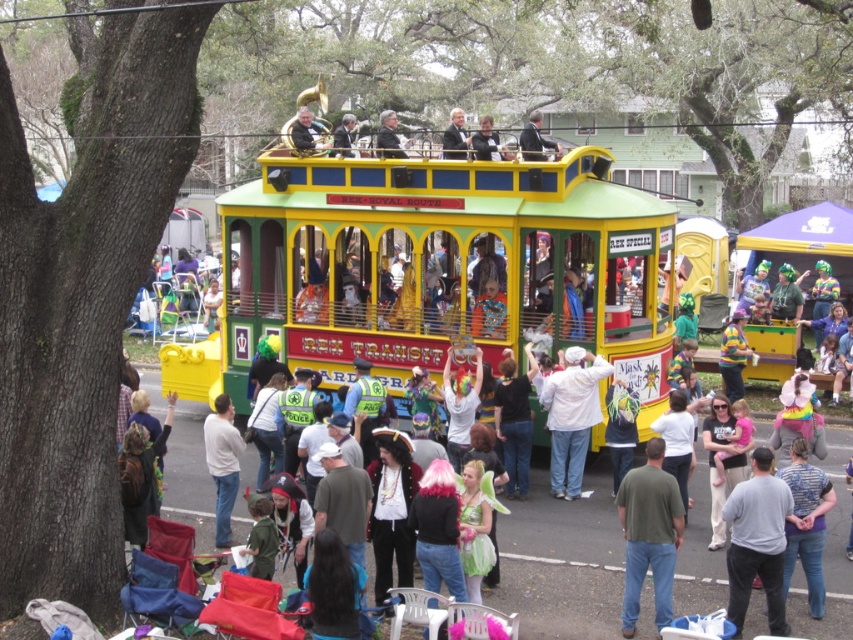
Does blue striped shirt at center appear over matte black jacket at upper center?

Actually, blue striped shirt at center is below matte black jacket at upper center.

Who is taller, blue striped shirt at center or matte black jacket at upper center?

Standing taller between the two is matte black jacket at upper center.

You are a GUI agent. You are given a task and a screenshot of the screen. Output one action in this format:
    pyautogui.click(x=<x>, y=<y>)
    Task: Click on the blue striped shirt at center
    
    Given the screenshot: What is the action you would take?
    pyautogui.click(x=805, y=524)

This screenshot has width=853, height=640. Identify the location of blue striped shirt at center. (x=805, y=524).

Which is behind, point (462, 157) or point (383, 141)?

The point (383, 141) is behind.

Does formal black suit at upper center come behind smooth gray suit at upper center?

No, formal black suit at upper center is closer to the viewer.

You are a GUI agent. You are given a task and a screenshot of the screen. Output one action in this format:
    pyautogui.click(x=<x>, y=<y>)
    Task: Click on the formal black suit at upper center
    The width and height of the screenshot is (853, 640).
    Given the screenshot: What is the action you would take?
    pyautogui.click(x=456, y=136)

Where is `formal black suit at upper center`? formal black suit at upper center is located at coordinates (456, 136).

Is green matte shirt at center bigger than white matte shirt at lower left?

Incorrect, green matte shirt at center is not larger than white matte shirt at lower left.

This screenshot has width=853, height=640. What do you see at coordinates (648, 534) in the screenshot? I see `green matte shirt at center` at bounding box center [648, 534].

Where is `green matte shirt at center`? The image size is (853, 640). green matte shirt at center is located at coordinates (648, 534).